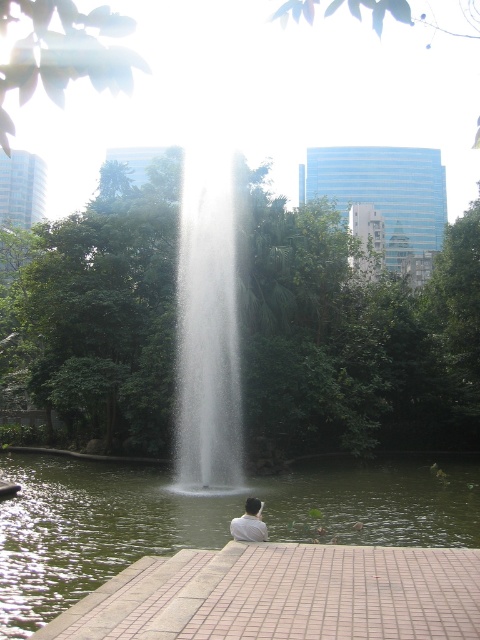
You are a photographer standing in the park and want to capture a photo of the green liquid water at center and the white matte shirt at lower center. Which object should you focus on first to ensure both are in sharp focus?

You should focus on the white matte shirt at lower center first because it is closer to you than the green liquid water at center, which is further away. This way, both objects will be in sharp focus.

You are standing at the fountain in the park and want to walk towards the person sitting on the paved area. Which point, point (121,552) or point (245,509), is closer to you?

Point (121,552) is closer to you because it is further to the viewer than point (245,509).